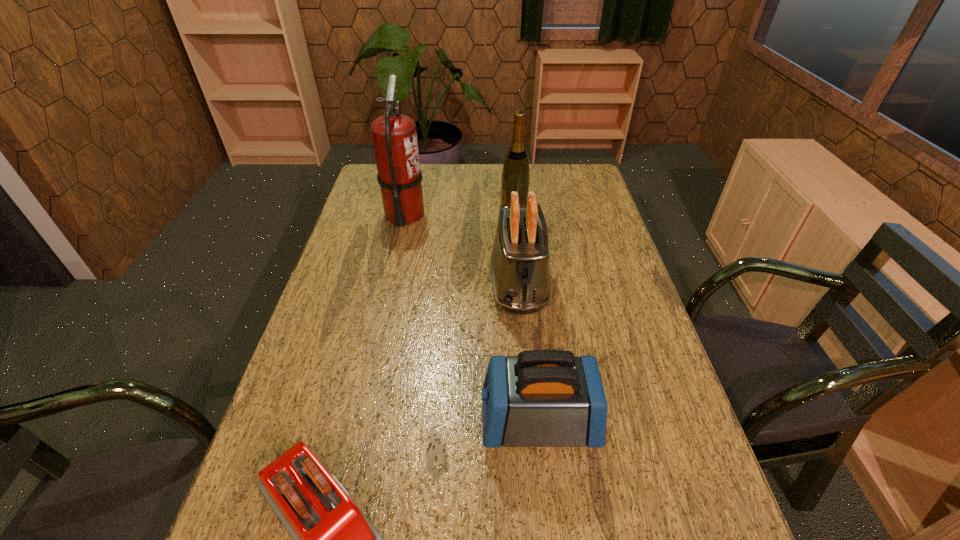
Where is `vacant point located between the farthest toaster and the tallest object`? The image size is (960, 540). vacant point located between the farthest toaster and the tallest object is located at coordinates (462, 249).

Image resolution: width=960 pixels, height=540 pixels. Find the location of `object that can be found as the closest to the tallest toaster`. object that can be found as the closest to the tallest toaster is located at coordinates 515,175.

Where is `object identified as the second closest to the third shortest object`? Image resolution: width=960 pixels, height=540 pixels. object identified as the second closest to the third shortest object is located at coordinates (541, 398).

I want to click on the closest toaster relative to the shortest object, so click(541, 398).

Image resolution: width=960 pixels, height=540 pixels. Identify the location of toaster identified as the closest to the second tallest toaster. (333, 539).